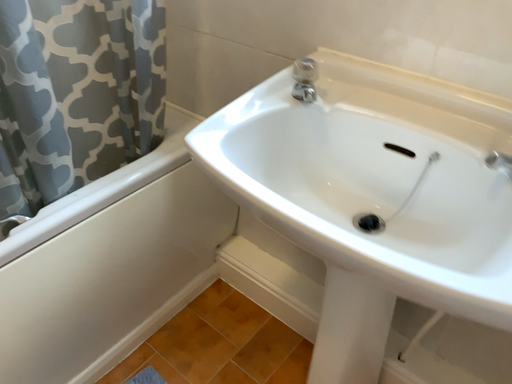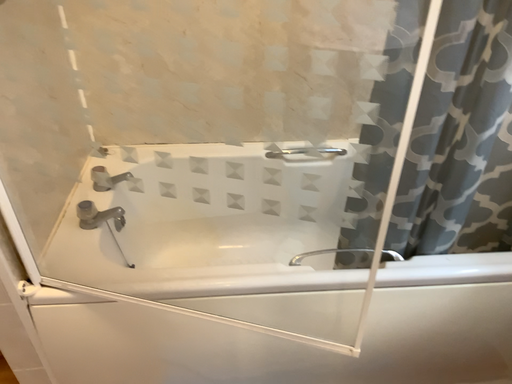
Question: How did the camera likely rotate when shooting the video?

Choices:
 (A) rotated left
 (B) rotated right

Answer: (A)